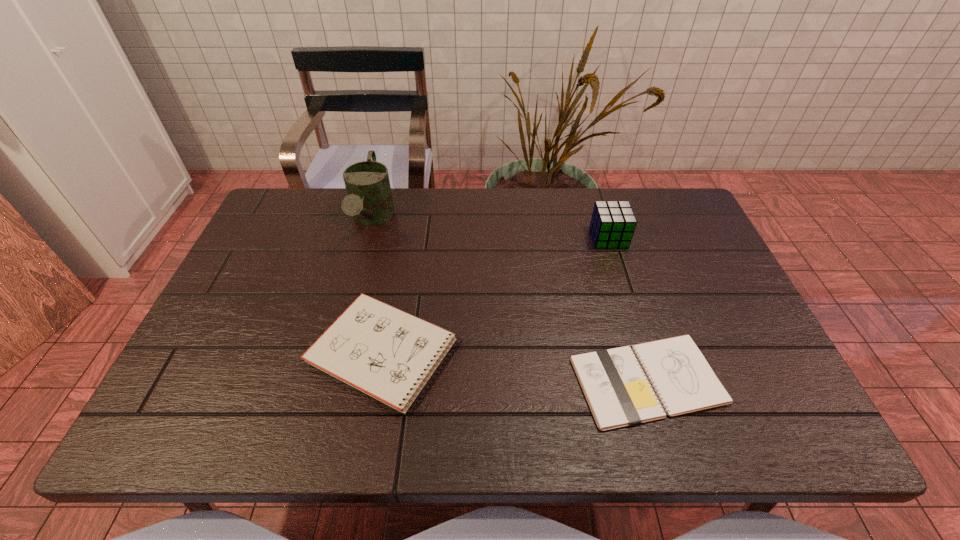
Select which object appears as the closest to the shortest object. Please provide its 2D coordinates. Your answer should be formatted as a tuple, i.e. [(x, y)], where the tuple contains the x and y coordinates of a point satisfying the conditions above.

[(388, 354)]

Where is `free space that satisfies the following two spatial constraints: 1. with the spout on the watering can; 2. on the right side of the taller notepad`? The width and height of the screenshot is (960, 540). free space that satisfies the following two spatial constraints: 1. with the spout on the watering can; 2. on the right side of the taller notepad is located at coordinates (336, 352).

The image size is (960, 540). In order to click on free space that satisfies the following two spatial constraints: 1. with the spout on the left notepad; 2. on the right side of the watering can in this screenshot , I will do `click(336, 352)`.

Locate an element on the screen. This screenshot has height=540, width=960. free spot that satisfies the following two spatial constraints: 1. with the spout on the cube; 2. on the right side of the tallest object is located at coordinates (367, 238).

I want to click on vacant space that satisfies the following two spatial constraints: 1. with the spout on the watering can; 2. on the left side of the second tallest object, so click(367, 238).

Where is `free space that satisfies the following two spatial constraints: 1. with the spout on the tallest object; 2. on the right side of the cube`? free space that satisfies the following two spatial constraints: 1. with the spout on the tallest object; 2. on the right side of the cube is located at coordinates (367, 238).

This screenshot has width=960, height=540. I want to click on free location that satisfies the following two spatial constraints: 1. on the back side of the taller notepad; 2. on the right side of the third shortest object, so click(x=405, y=238).

At what (x,y) coordinates should I click in order to perform the action: click on vacant region that satisfies the following two spatial constraints: 1. on the back side of the third tallest object; 2. on the left side of the cube. Please return your answer as a coordinate pair (x, y). Looking at the image, I should click on (405, 238).

Identify the location of free space that satisfies the following two spatial constraints: 1. with the spout on the watering can; 2. on the left side of the shorter notepad. (328, 381).

Where is `vacant region that satisfies the following two spatial constraints: 1. with the spout on the third tallest object; 2. on the left side of the watering can`? vacant region that satisfies the following two spatial constraints: 1. with the spout on the third tallest object; 2. on the left side of the watering can is located at coordinates (336, 352).